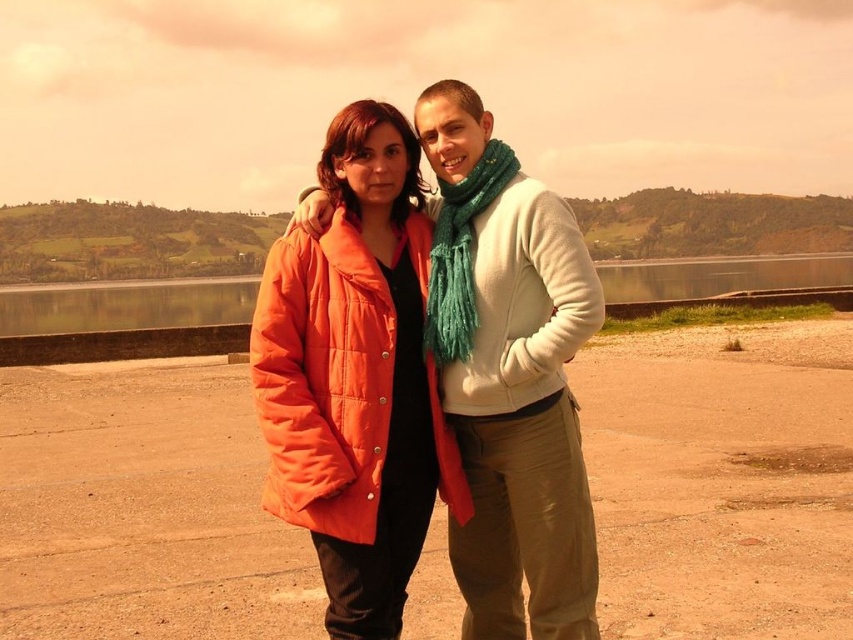
You are a photographer trying to capture the scene with the quilted orange jacket at center and the transparent glass water at lower left. Which object should you focus on first if you want to ensure both are in sharp focus?

The quilted orange jacket at center has a smaller size compared to transparent glass water at lower left, so you should focus on the quilted orange jacket at center first to ensure both are in sharp focus.

You are a photographer trying to capture a clear shot of the orange puffy coat at center and the quilted orange jacket at center. Which one is positioned lower in the frame?

The orange puffy coat at center is located below the quilted orange jacket at center, so it is positioned lower in the frame.

You are a photographer trying to capture a wide shot of the two people in the image. The quilted orange jacket at center and transparent glass water at lower left are part of the scene. Given that your camera can focus on objects within a 100 meter range, will both objects be in focus?

The quilted orange jacket at center and transparent glass water at lower left are 118.07 meters apart from each other. Since the distance exceeds the camera focus range of 100 meters, it is likely that both objects cannot be in focus simultaneously.